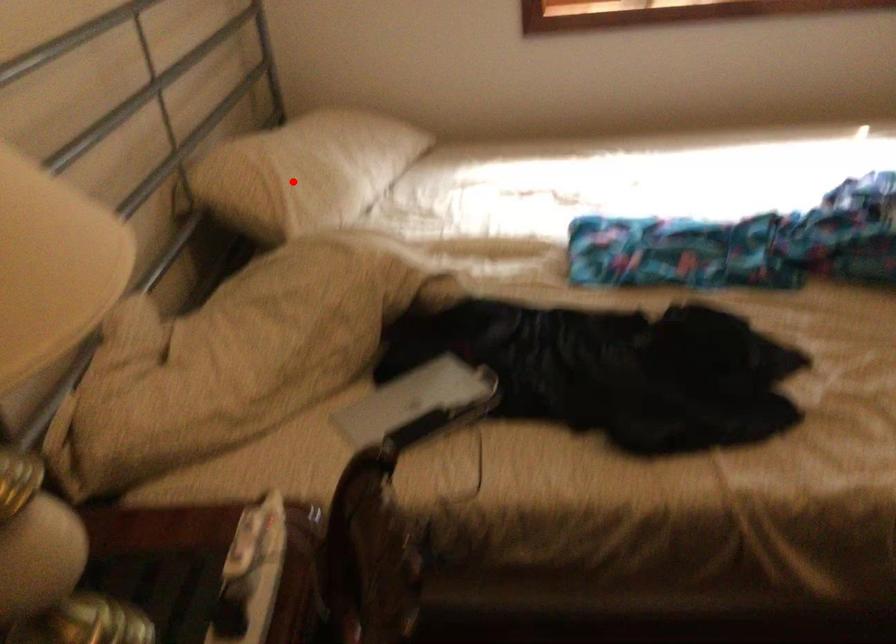
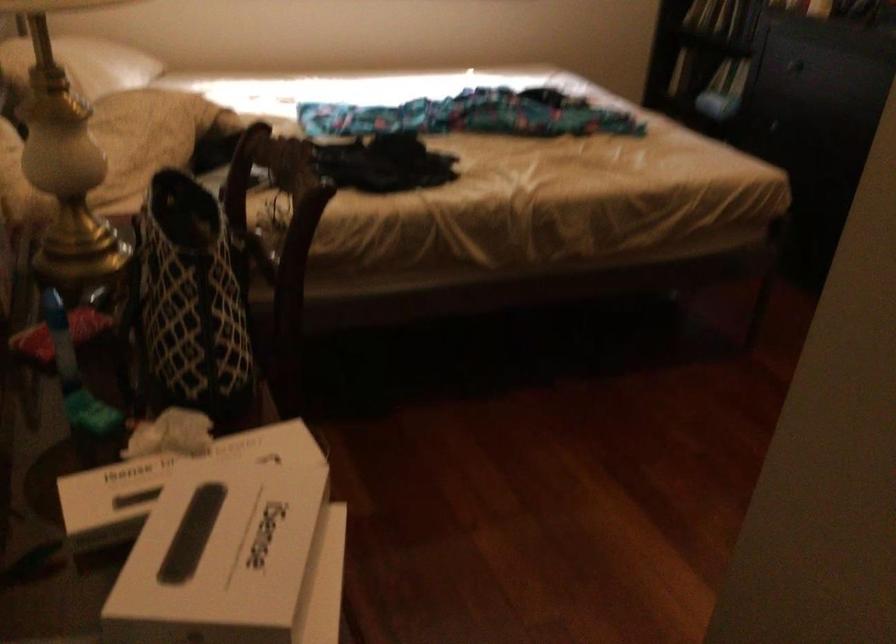
Find the pixel in the second image that matches the highlighted location in the first image.

(82, 64)